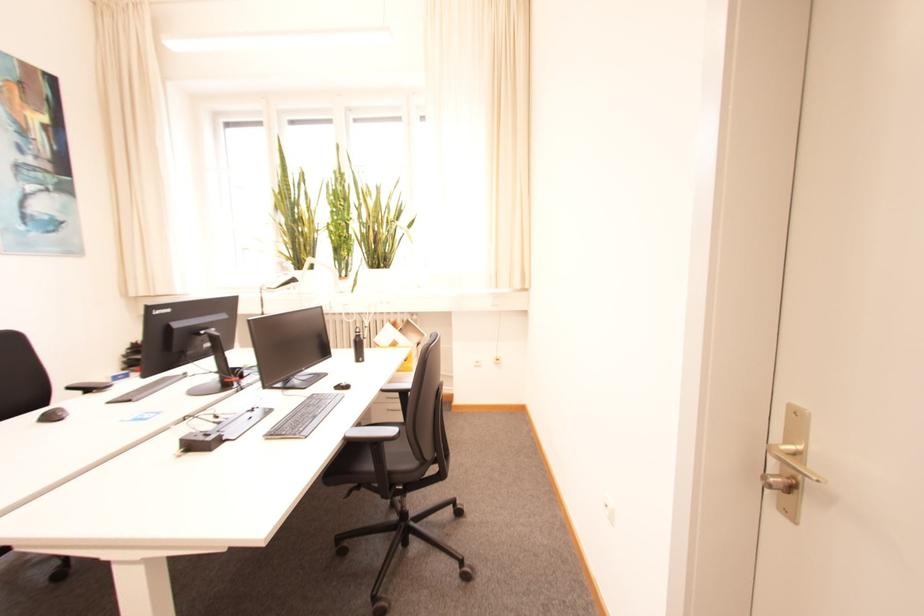
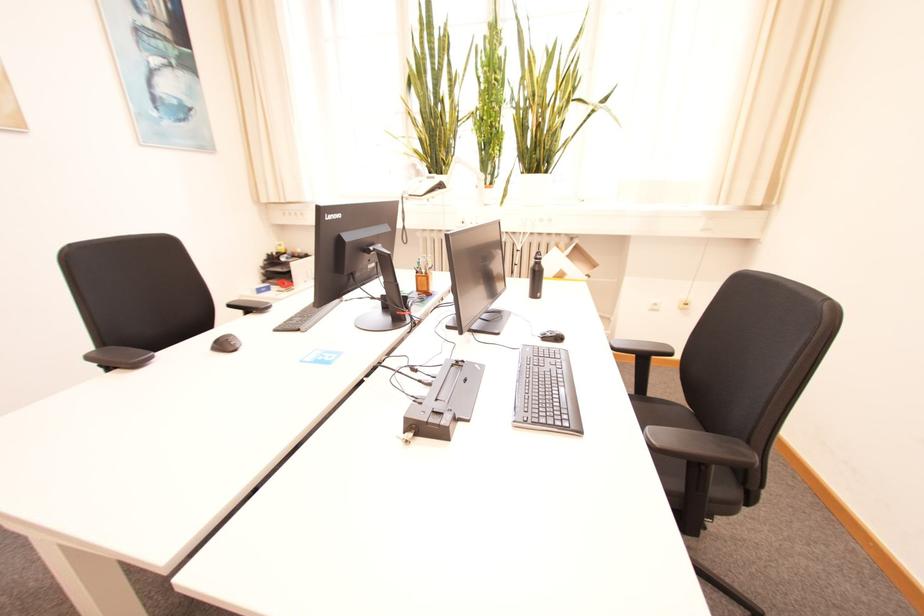
Find the pixel in the second image that matches the point at 345,389 in the first image.

(551, 338)